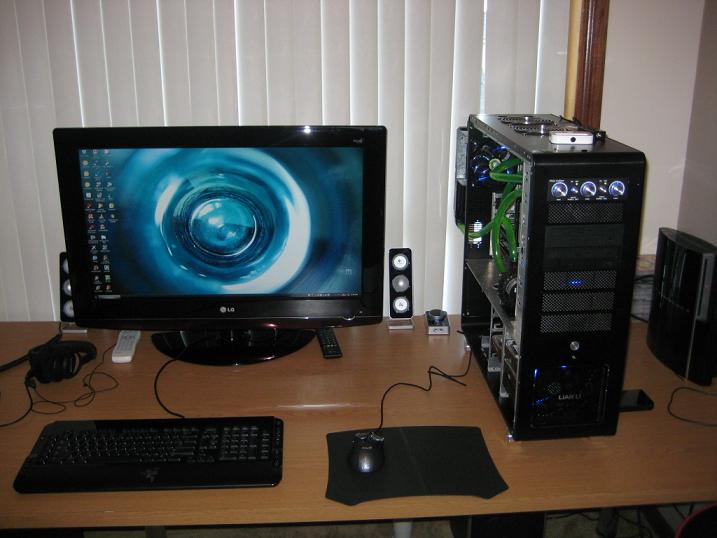
In order to click on remote control in this screenshot , I will do `click(335, 341)`, `click(122, 351)`.